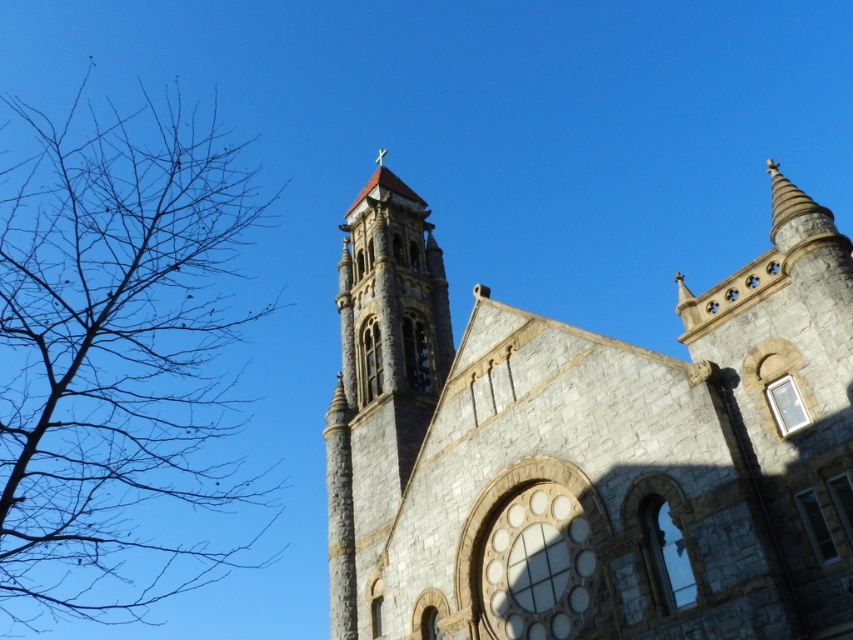
Is stone church at center to the left of brown bare branches at left from the viewer's perspective?

In fact, stone church at center is to the right of brown bare branches at left.

Does stone church at center have a smaller size compared to brown bare branches at left?

Yes.

Does point (480, 525) come behind point (125, 138)?

No, (480, 525) is closer to viewer.

Find the location of `stone church at center`. stone church at center is located at coordinates (589, 449).

Consider the image. Which is more to the left, brown bare branches at left or stone bell tower at center?

brown bare branches at left is more to the left.

Measure the distance from brown bare branches at left to stone bell tower at center.

The distance of brown bare branches at left from stone bell tower at center is 51.74 meters.

Find the location of `brown bare branches at left`. brown bare branches at left is located at coordinates (114, 352).

I want to click on brown bare branches at left, so click(114, 352).

Is stone church at center positioned before stone bell tower at center?

Yes.

Which of these two, stone church at center or stone bell tower at center, stands shorter?

With less height is stone church at center.

Is point (724, 616) closer to viewer compared to point (375, 250)?

That is True.

I want to click on stone church at center, so click(x=589, y=449).